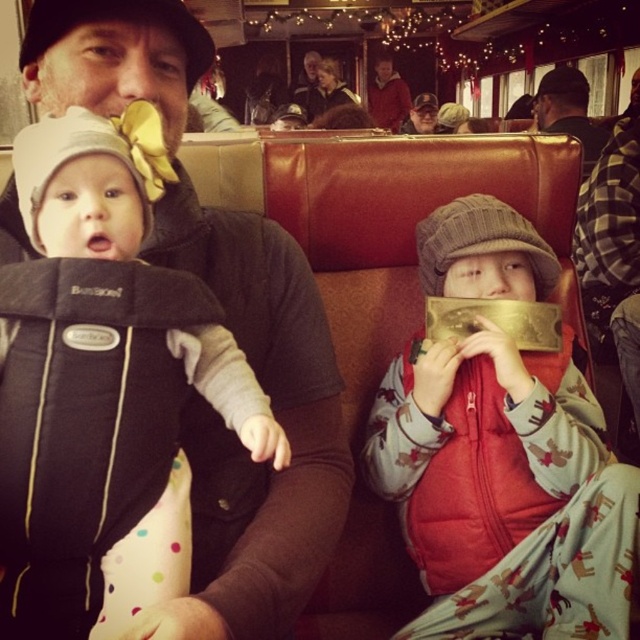
You are a photographer trying to take a closeup of the soft black fabric baby carrier at left from your current position. Given that your camera can focus as close as 23 inches, will you be able to capture a clear image without moving closer?

The distance between the soft black fabric baby carrier at left and the camera is 22.99 inches, which is just under the camera minimum focusing distance of 23 inches. Therefore, you will not be able to capture a clear image without moving slightly further back to increase the distance.

You are a fashion designer observing the train carriage scene. You need to recommend a storage box for the red fleece vest at center and the matte black jacket at center. If the storage box can only accommodate one of them, which one should you choose based on their sizes?

The red fleece vest at center has a larger width than the matte black jacket at center, so the storage box should be chosen to fit the red fleece vest at center.

You are a photographer taking a picture of the scene. You notice a point at coordinates (504, 492). Based on the scene description, where is this point located?

The point at coordinates (504, 492) is located on the red fleece vest at center.